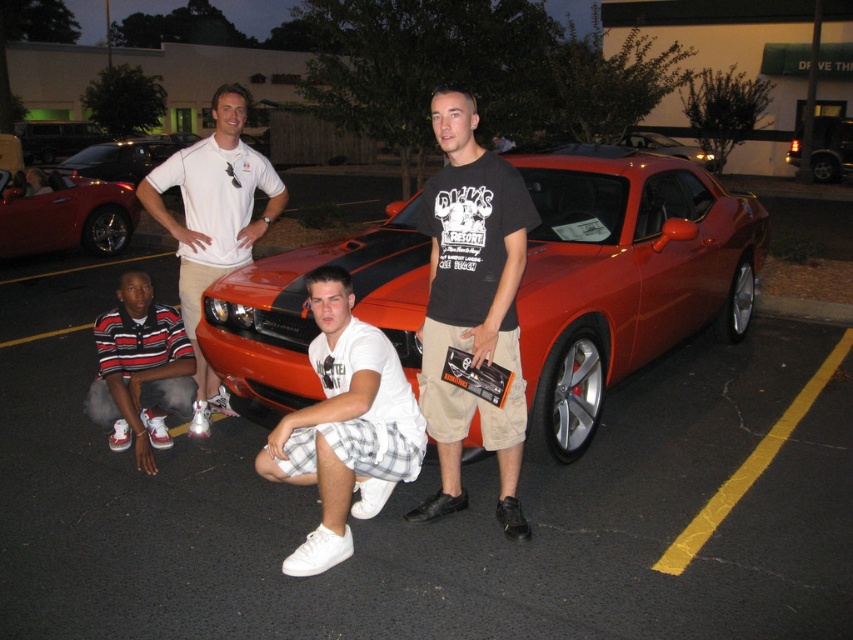
You are standing in front of the red sports car and want to touch both points on the car. Which point, point (317, 426) or point (814, 118), will you reach first?

Point (317, 426) is closer to the viewer than point (814, 118), so you will reach point (317, 426) first.

Looking at this image, based on the scene description, where is the striped cotton shirt at lower left positioned in the image?

The striped cotton shirt at lower left is positioned at point 2D coordinates of 0.580 on the x axis and 0.165 on the y axis.

Consider the image. You are a photographer trying to capture the shiny red convertible at left and the white cotton polo shirt at upper center in a single frame. Based on their positions, which object should you focus on first to ensure both are in focus?

The white cotton polo shirt at upper center is below the shiny red convertible at left, so you should focus on the shiny red convertible at left first to ensure both are in focus.